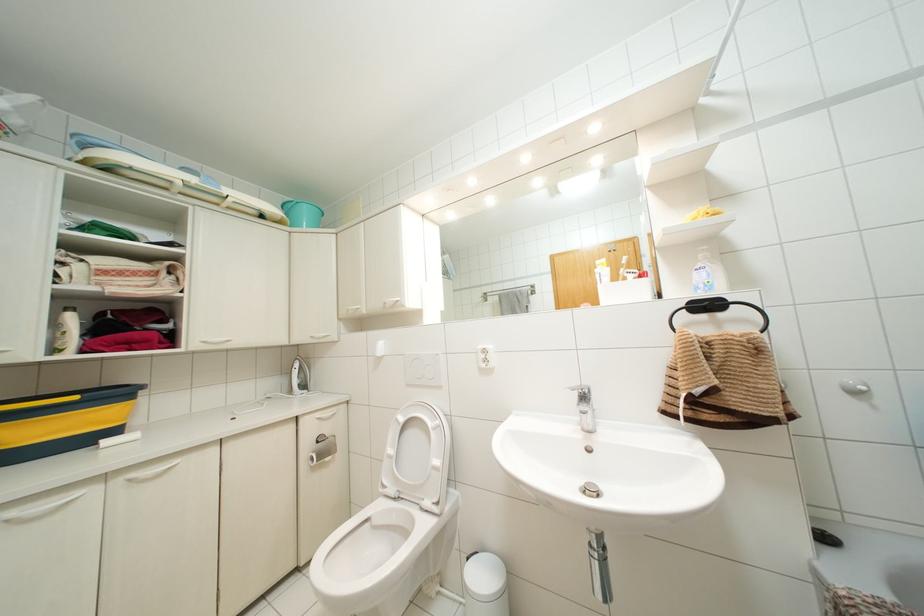
Find the location of a particular element. The width and height of the screenshot is (924, 616). white toilet lid is located at coordinates (417, 456).